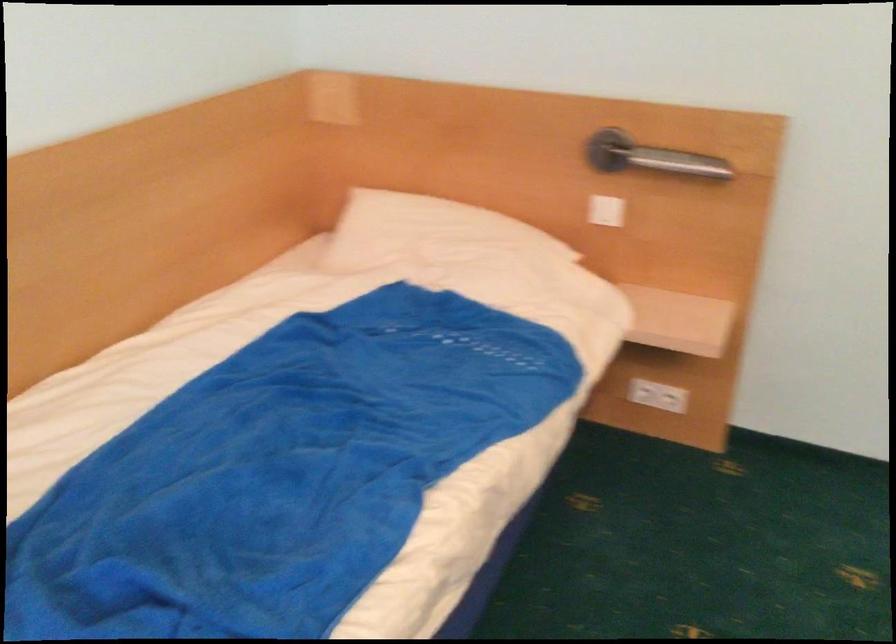
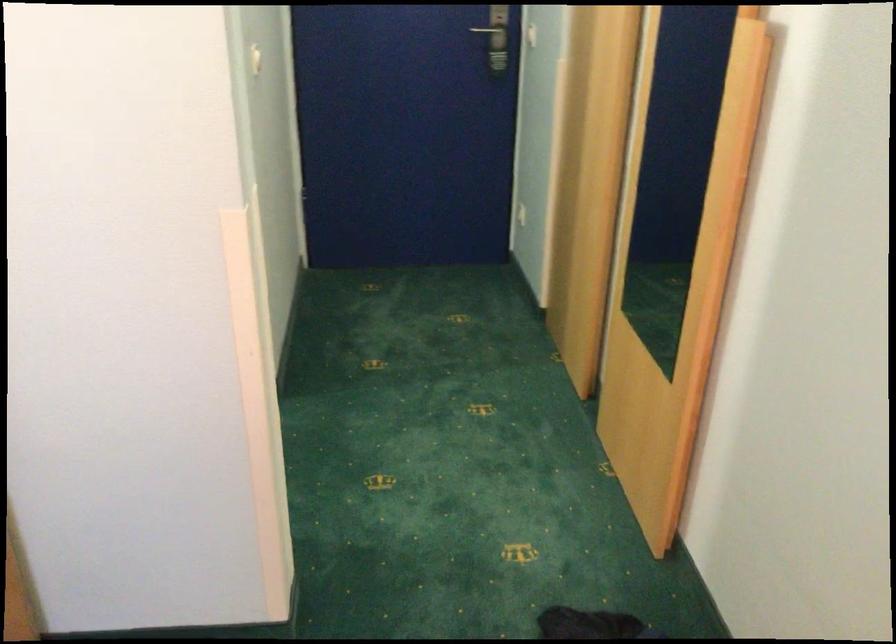
Question: The camera is either moving clockwise (left) or counter-clockwise (right) around the object. The first image is from the beginning of the video and the second image is from the end. Is the camera moving left or right when shooting the video?

Choices:
 (A) Left
 (B) Right

Answer: (A)